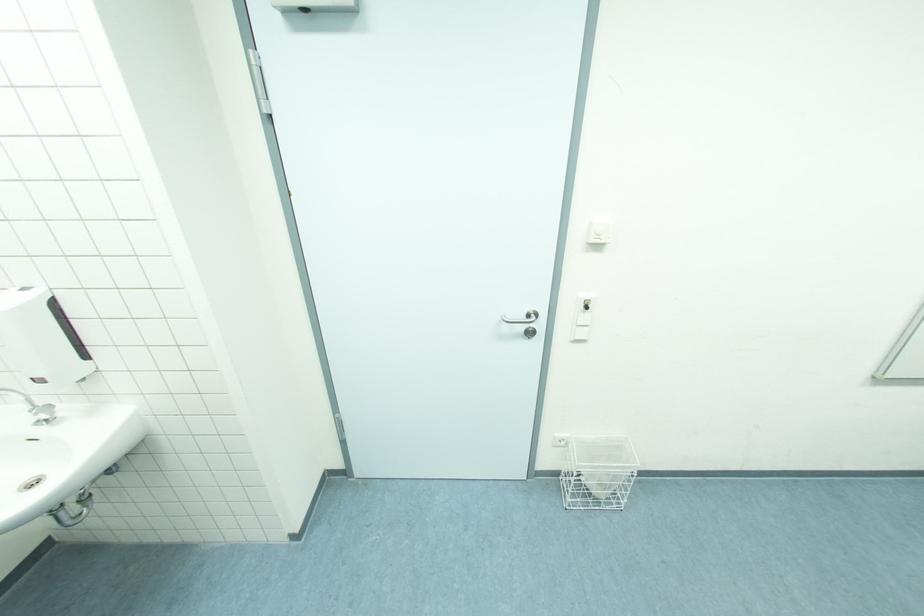
What are the coordinates of `door keyhole` in the screenshot? It's located at (529, 331).